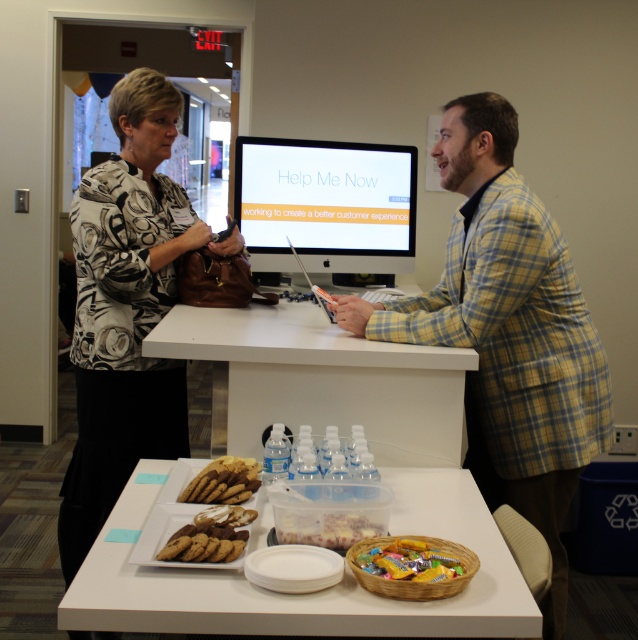
You are a delivery person who needs to place a small package on the table between the shiny plastic basket of candy at lower center and the golden crumbly cookies at center. Based on their widths, can you determine if there is enough space between them to fit the package?

The shiny plastic basket of candy at lower center might be wider than golden crumbly cookies at center, so there may not be enough space between them to fit the package.